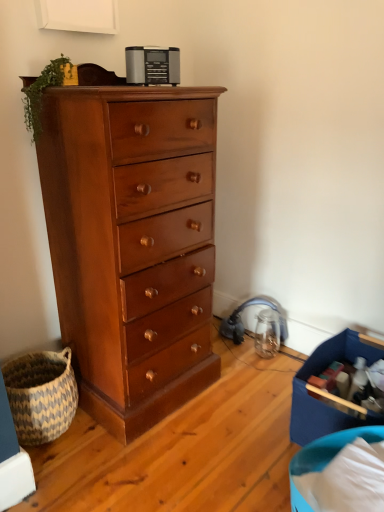
Question: In terms of size, does natural woven basket at lower left appear bigger or smaller than shiny brown wood chest of drawers at left?

Choices:
 (A) small
 (B) big

Answer: (A)

Question: Do you think natural woven basket at lower left is within shiny brown wood chest of drawers at left, or outside of it?

Choices:
 (A) inside
 (B) outside

Answer: (B)

Question: Considering the real-world distances, which object is closest to the natural woven basket at lower left?

Choices:
 (A) satin silver radio at upper center
 (B) blue fabric storage box at lower right
 (C) shiny brown wood chest of drawers at left

Answer: (C)

Question: Which object is positioned closest to the shiny brown wood chest of drawers at left?

Choices:
 (A) blue fabric storage box at lower right
 (B) natural woven basket at lower left
 (C) satin silver radio at upper center

Answer: (B)